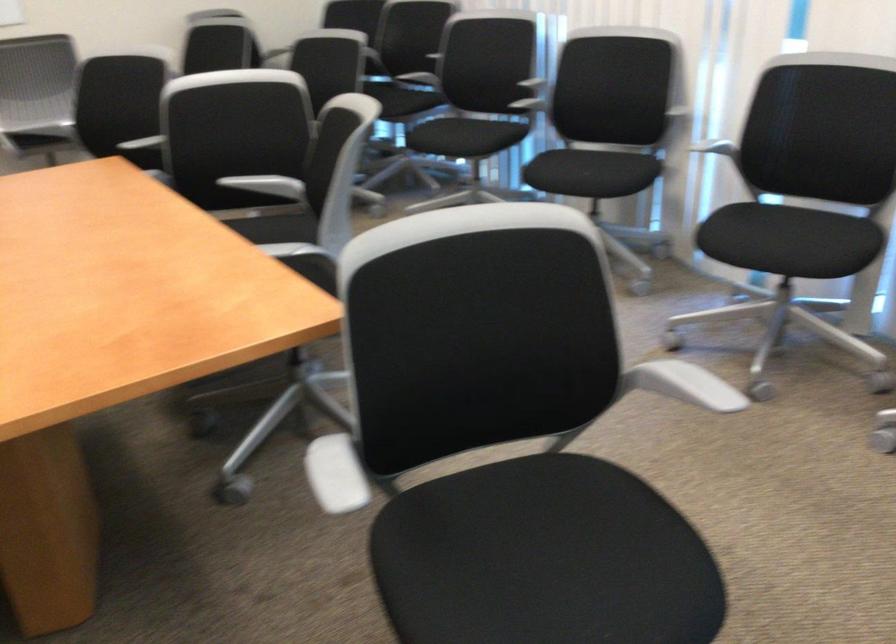
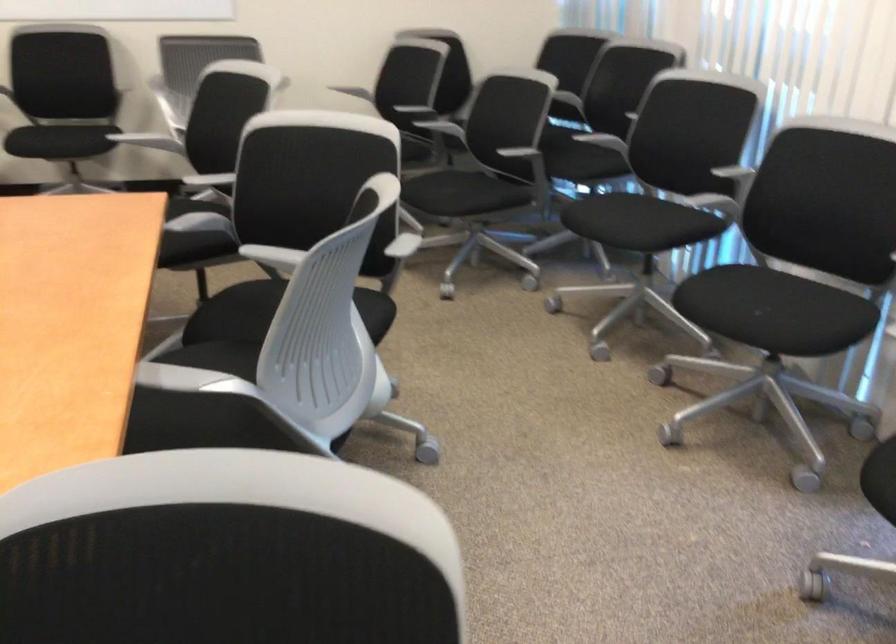
In a continuous first-person perspective shot, in which direction is the camera moving?

The cameraman moved toward right, forward.